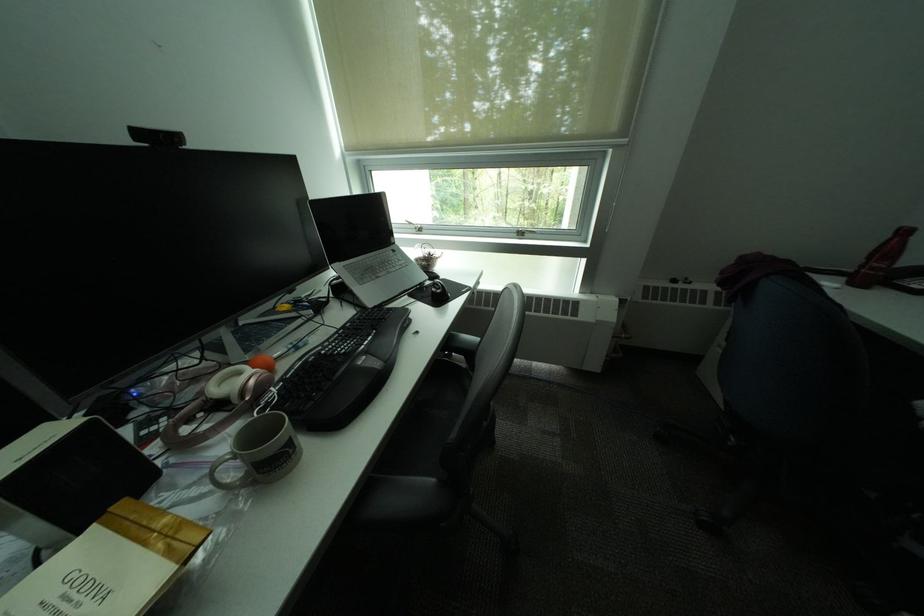
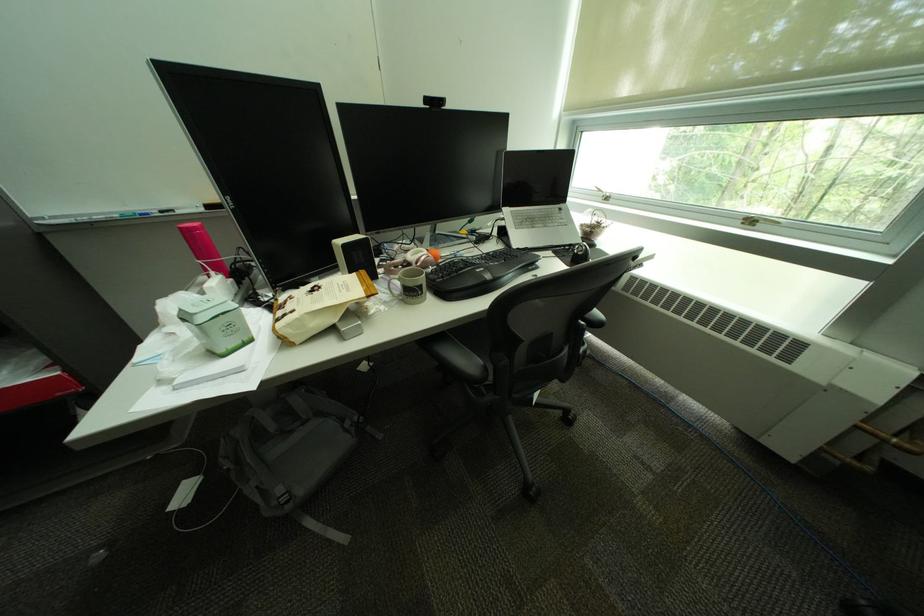
Where in the second image is the point corresponding to pixel 211 416 from the first image?

(410, 268)